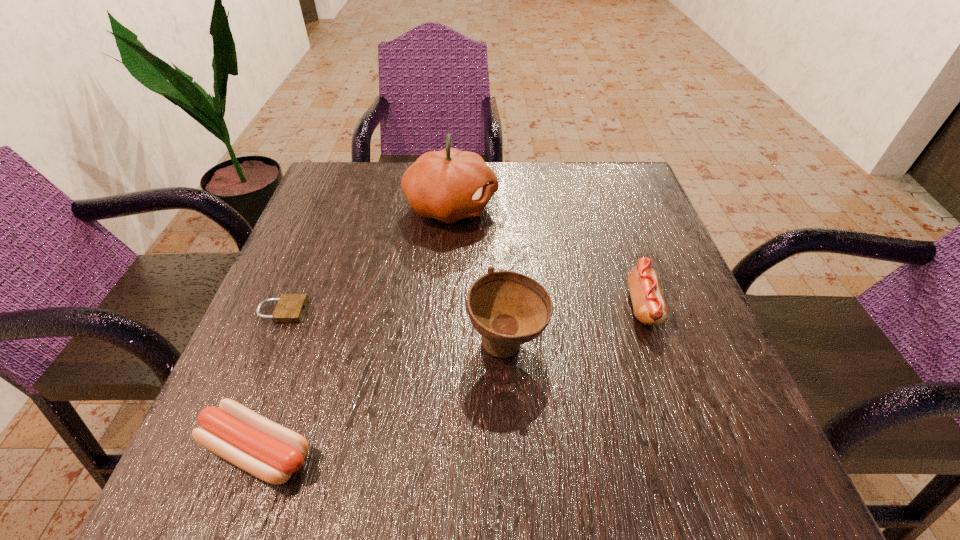
This screenshot has width=960, height=540. What are the coordinates of `free space that satisfies the following two spatial constraints: 1. on the front face of the farthest object; 2. on the right side of the rightmost object` in the screenshot? It's located at (444, 305).

Find the location of a particular element. The image size is (960, 540). vacant area that satisfies the following two spatial constraints: 1. on the keyhole side of the padlock; 2. on the left side of the nearer sausage is located at coordinates (224, 450).

Locate an element on the screen. The width and height of the screenshot is (960, 540). vacant position in the image that satisfies the following two spatial constraints: 1. on the keyhole side of the left sausage; 2. on the left side of the padlock is located at coordinates (224, 450).

You are a GUI agent. You are given a task and a screenshot of the screen. Output one action in this format:
    pyautogui.click(x=<x>, y=<y>)
    Task: Click on the vacant area in the image that satisfies the following two spatial constraints: 1. on the front face of the pumpkin; 2. on the left side of the soup bowl
    Image resolution: width=960 pixels, height=540 pixels.
    Given the screenshot: What is the action you would take?
    pyautogui.click(x=441, y=343)

Where is `free location that satisfies the following two spatial constraints: 1. on the keyhole side of the shortest object; 2. on the back side of the nearer sausage`? free location that satisfies the following two spatial constraints: 1. on the keyhole side of the shortest object; 2. on the back side of the nearer sausage is located at coordinates click(224, 450).

You are a GUI agent. You are given a task and a screenshot of the screen. Output one action in this format:
    pyautogui.click(x=<x>, y=<y>)
    Task: Click on the free space that satisfies the following two spatial constraints: 1. on the back side of the right sausage; 2. on the front face of the tallest object
    This screenshot has width=960, height=540.
    Given the screenshot: What is the action you would take?
    pyautogui.click(x=609, y=207)